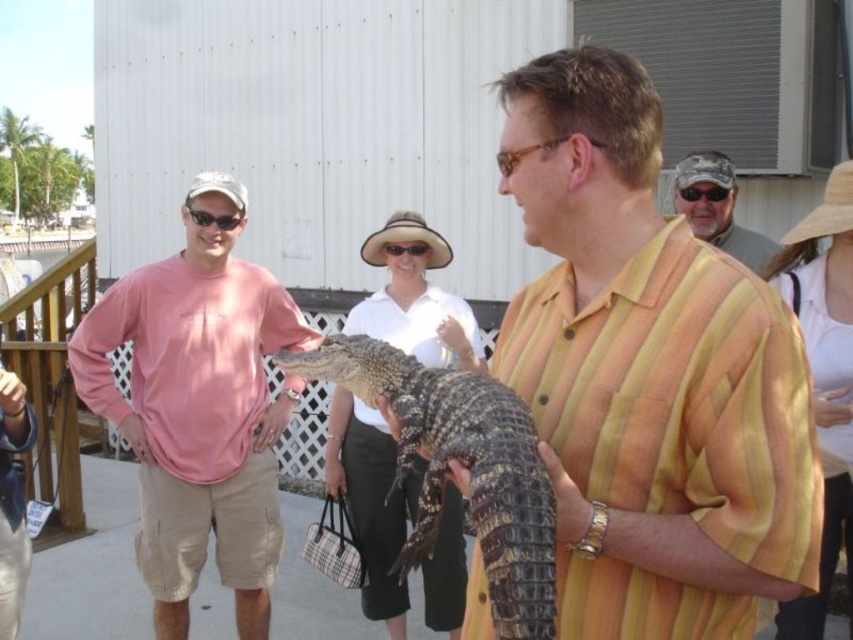
Is yellow striped shirt at center closer to camera compared to matte khaki shorts at right?

Yes.

Does yellow striped shirt at center have a lesser width compared to matte khaki shorts at right?

No, yellow striped shirt at center is not thinner than matte khaki shorts at right.

Does point (811, 422) come farther from viewer compared to point (723, 161)?

That is False.

Where is `yellow striped shirt at center`? The image size is (853, 640). yellow striped shirt at center is located at coordinates (648, 374).

Between pink long-sleeve shirt at left and matte khaki shorts at right, which one appears on the right side from the viewer's perspective?

From the viewer's perspective, matte khaki shorts at right appears more on the right side.

Is point (234, 312) positioned before point (694, 160)?

Yes, point (234, 312) is closer to viewer.

Image resolution: width=853 pixels, height=640 pixels. I want to click on pink long-sleeve shirt at left, so pyautogui.click(x=199, y=406).

Which of these two, pink long-sleeve shirt at left or scaly brown alligator at center, stands taller?

pink long-sleeve shirt at left is taller.

Does pink long-sleeve shirt at left have a greater height compared to scaly brown alligator at center?

Yes.

Measure the distance between pink long-sleeve shirt at left and camera.

pink long-sleeve shirt at left and camera are 4.00 meters apart from each other.

Find the location of `pink long-sleeve shirt at left`. pink long-sleeve shirt at left is located at coordinates (199, 406).